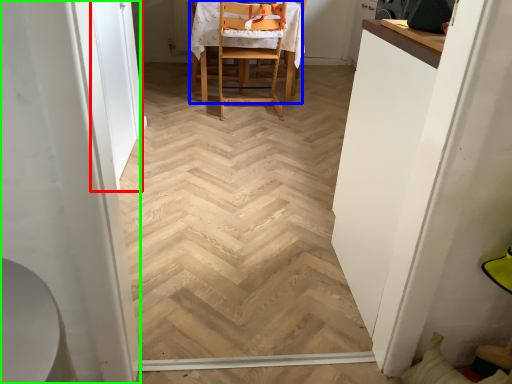
Question: Based on their relative distances, which object is nearer to screen door (highlighted by a red box)? Choose from chair (highlighted by a blue box) and screen door (highlighted by a green box).

Choices:
 (A) chair
 (B) screen door

Answer: (A)